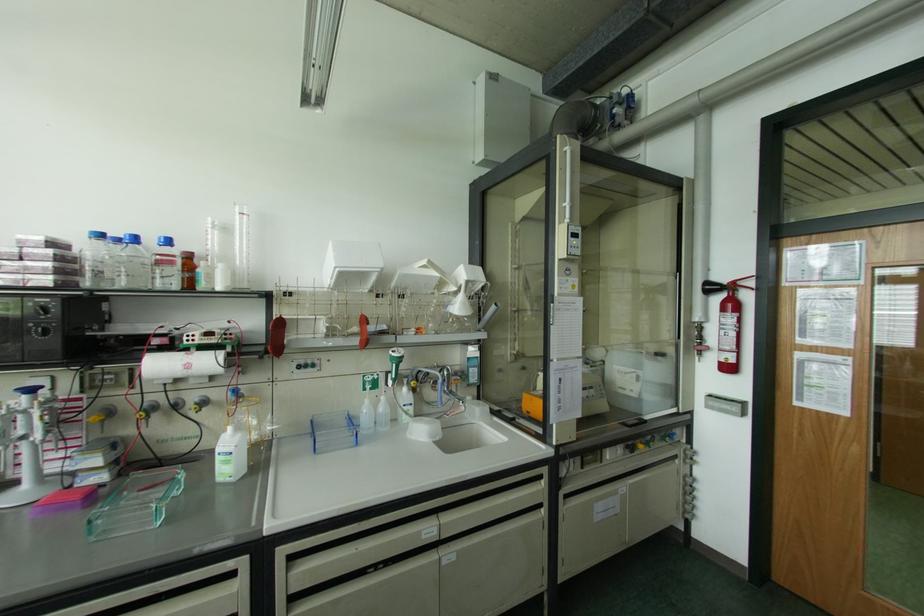
This screenshot has height=616, width=924. Describe the element at coordinates (39, 331) in the screenshot. I see `the black control dial` at that location.